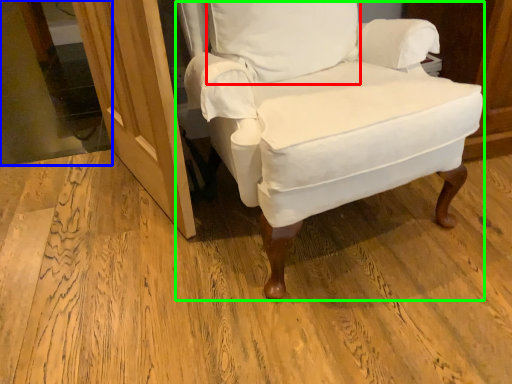
Question: Estimate the real-world distances between objects in this image. Which object is closer to pillow (highlighted by a red box), glass door (highlighted by a blue box) or chair (highlighted by a green box)?

Choices:
 (A) glass door
 (B) chair

Answer: (B)